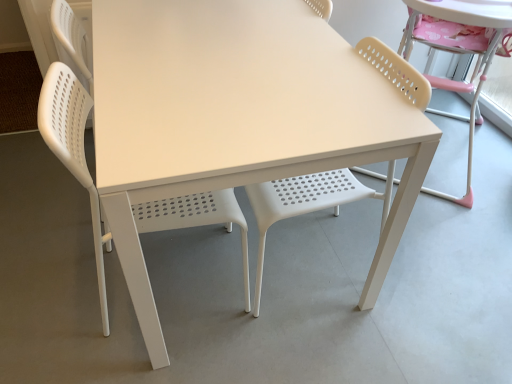
The image size is (512, 384). I want to click on free point below white plastic chair at left, which ranks as the 1th chair in left-to-right order (from a real-world perspective), so click(185, 277).